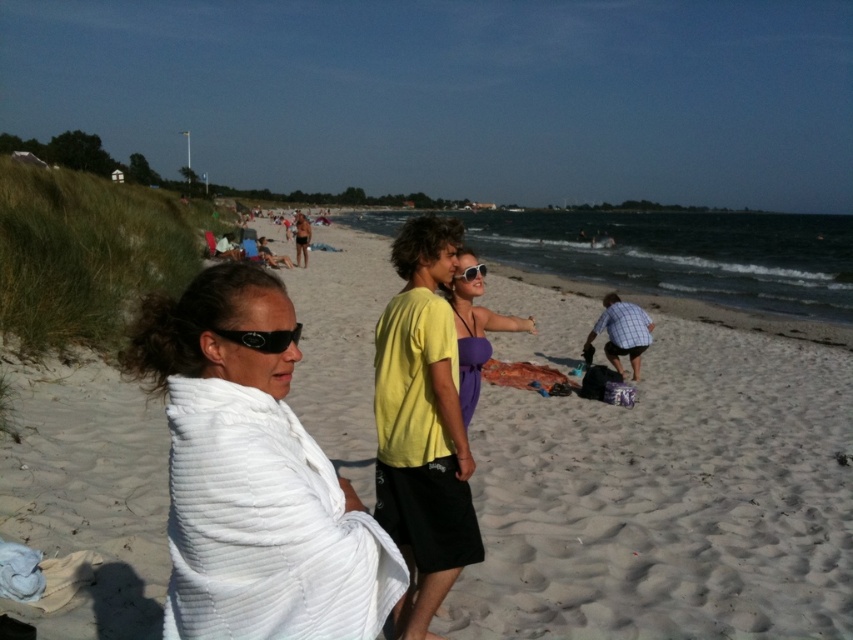
Question: Considering the real-world distances, which object is closest to the checkered fabric shirt at lower right?

Choices:
 (A) black matte sunglasses at center
 (B) yellow cotton t-shirt at center

Answer: (B)

Question: Can you confirm if yellow cotton t-shirt at center is positioned to the left of checkered fabric shirt at lower right?

Choices:
 (A) yes
 (B) no

Answer: (A)

Question: Among these objects, which one is nearest to the camera?

Choices:
 (A) sunglasses at center
 (B) yellow cotton t-shirt at center

Answer: (B)

Question: Is white sand at center to the right of sunglasses at center from the viewer's perspective?

Choices:
 (A) no
 (B) yes

Answer: (B)

Question: Can you confirm if white sand at center is thinner than matte yellow shirt at center?

Choices:
 (A) no
 (B) yes

Answer: (A)

Question: Which is farther from the black matte sunglasses at center?

Choices:
 (A) matte yellow shirt at center
 (B) yellow cotton t-shirt at center
 (C) sunglasses at center

Answer: (A)